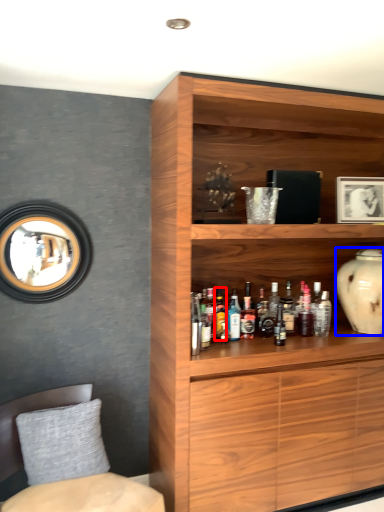
Question: Which of the following is the farthest to the observer, bottle (highlighted by a red box) or vase (highlighted by a blue box)?

Choices:
 (A) bottle
 (B) vase

Answer: (B)